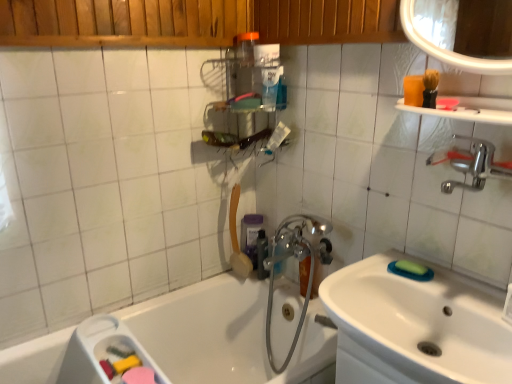
Question: Should I look upward or downward to see purple matte soap dispenser at upper center, which ranks as the 2th toiletry in top-to-bottom order?

Choices:
 (A) down
 (B) up

Answer: (A)

Question: From the image's perspective, would you say transparent plastic bottle at upper center, the 3th toiletry in the bottom-to-top sequence, is positioned over white glossy sink at lower right?

Choices:
 (A) yes
 (B) no

Answer: (A)

Question: Is transparent plastic bottle at upper center, which is the 3th toiletry from back to front, bigger than white glossy sink at lower right?

Choices:
 (A) yes
 (B) no

Answer: (B)

Question: From the image's perspective, is transparent plastic bottle at upper center, the 3th toiletry in the bottom-to-top sequence, beneath white glossy sink at lower right?

Choices:
 (A) no
 (B) yes

Answer: (A)

Question: Is transparent plastic bottle at upper center, arranged as the first toiletry when viewed from the front, positioned with its back to white glossy sink at lower right?

Choices:
 (A) yes
 (B) no

Answer: (B)

Question: Is transparent plastic bottle at upper center, the 3th toiletry in the bottom-to-top sequence, next to white glossy sink at lower right and touching it?

Choices:
 (A) yes
 (B) no

Answer: (B)

Question: Does transparent plastic bottle at upper center, arranged as the first toiletry when viewed from the front, appear on the right side of white glossy sink at lower right?

Choices:
 (A) no
 (B) yes

Answer: (A)

Question: From a real-world perspective, is black plastic bottle at center, placed as the second toiletry when sorted from front to back, on top of transparent plastic bottle at upper center, which is the 3th toiletry from back to front?

Choices:
 (A) no
 (B) yes

Answer: (A)

Question: Would you say black plastic bottle at center, the first toiletry in the bottom-to-top sequence, contains transparent plastic bottle at upper center, the 1th toiletry positioned from the top?

Choices:
 (A) no
 (B) yes

Answer: (A)

Question: Can you confirm if black plastic bottle at center, the third toiletry viewed from the top, is wider than transparent plastic bottle at upper center, the 1th toiletry positioned from the top?

Choices:
 (A) no
 (B) yes

Answer: (A)

Question: Is black plastic bottle at center, placed as the second toiletry when sorted from front to back, smaller than transparent plastic bottle at upper center, which is the 3th toiletry from back to front?

Choices:
 (A) no
 (B) yes

Answer: (B)

Question: Could you tell me if black plastic bottle at center, placed as the second toiletry when sorted from front to back, is turned towards transparent plastic bottle at upper center, the 1th toiletry positioned from the top?

Choices:
 (A) no
 (B) yes

Answer: (A)

Question: Does black plastic bottle at center, the first toiletry in the bottom-to-top sequence, have a lesser width compared to transparent plastic bottle at upper center, arranged as the first toiletry when viewed from the front?

Choices:
 (A) no
 (B) yes

Answer: (B)

Question: Is metallic silver shelf at upper center looking in the opposite direction of matte orange shower head at upper center?

Choices:
 (A) yes
 (B) no

Answer: (B)